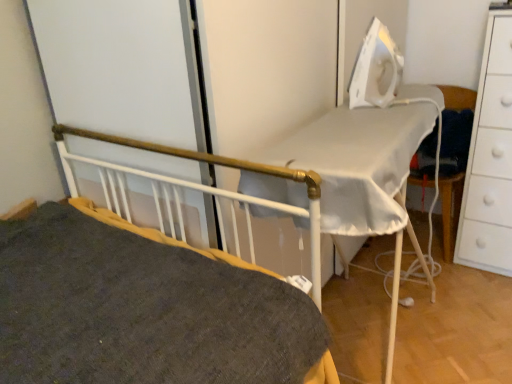
The width and height of the screenshot is (512, 384). Identify the location of vacant space in front of white matte chest of drawers at right. (481, 290).